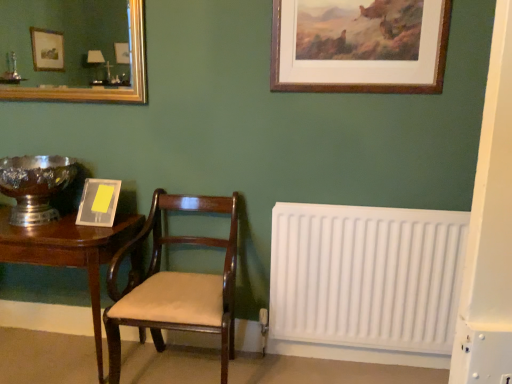
Question: Is mahogany wood table at left wider than matte gray picture frame at left, acting as the 1th picture frame starting from the left?

Choices:
 (A) no
 (B) yes

Answer: (B)

Question: Is mahogany wood table at left to the right of matte gray picture frame at left, which ranks as the second picture frame in top-to-bottom order, from the viewer's perspective?

Choices:
 (A) yes
 (B) no

Answer: (B)

Question: Can you confirm if mahogany wood table at left is positioned to the left of matte gray picture frame at left, acting as the 1th picture frame starting from the left?

Choices:
 (A) no
 (B) yes

Answer: (B)

Question: Can you confirm if mahogany wood table at left is smaller than matte gray picture frame at left, the second picture frame viewed from the right?

Choices:
 (A) no
 (B) yes

Answer: (A)

Question: Is mahogany wood table at left not close to matte gray picture frame at left, the second picture frame viewed from the right?

Choices:
 (A) no
 (B) yes

Answer: (A)

Question: From the image's perspective, is mahogany wood table at left above matte gray picture frame at left, acting as the 1th picture frame starting from the left?

Choices:
 (A) yes
 (B) no

Answer: (B)

Question: Can you confirm if matte gray picture frame at left, which ranks as the second picture frame in top-to-bottom order, is bigger than mahogany wood table at left?

Choices:
 (A) no
 (B) yes

Answer: (A)

Question: Is matte gray picture frame at left, which ranks as the second picture frame in top-to-bottom order, further to camera compared to mahogany wood table at left?

Choices:
 (A) no
 (B) yes

Answer: (B)

Question: From the image's perspective, is matte gray picture frame at left, which ranks as the second picture frame in top-to-bottom order, over mahogany wood table at left?

Choices:
 (A) no
 (B) yes

Answer: (B)

Question: From a real-world perspective, does matte gray picture frame at left, which ranks as the second picture frame in top-to-bottom order, sit lower than mahogany wood table at left?

Choices:
 (A) no
 (B) yes

Answer: (A)

Question: Can you confirm if matte gray picture frame at left, acting as the 1th picture frame starting from the left, is positioned to the left of mahogany wood table at left?

Choices:
 (A) no
 (B) yes

Answer: (A)

Question: Is matte gray picture frame at left, acting as the 1th picture frame starting from the left, far away from mahogany wood table at left?

Choices:
 (A) no
 (B) yes

Answer: (A)

Question: Does shiny silver bowl at left have a greater width compared to mahogany wood chair at center?

Choices:
 (A) yes
 (B) no

Answer: (B)